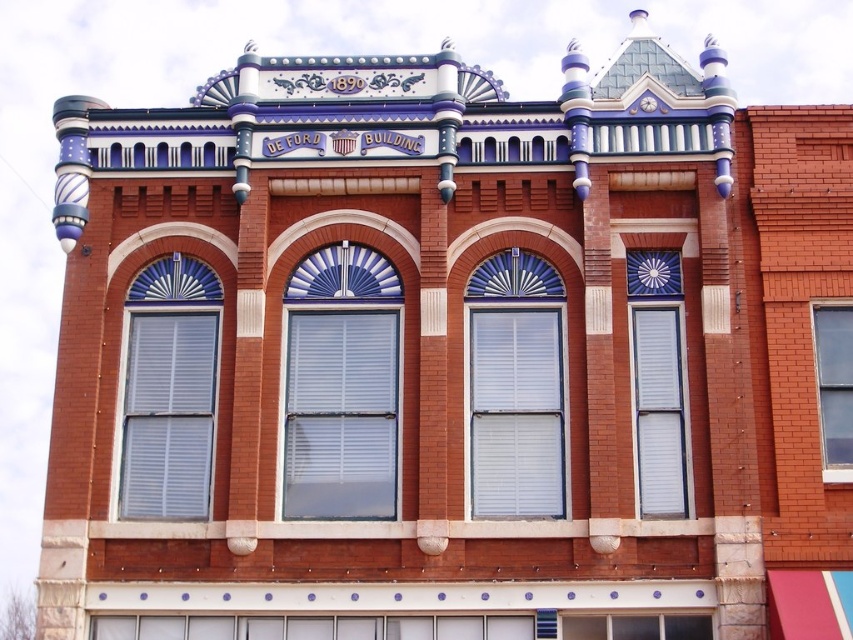
Question: Where is white painted wood window at center located in relation to white textured shutters at center in the image?

Choices:
 (A) right
 (B) left

Answer: (B)

Question: Is white matte window at left thinner than clear glass window at right?

Choices:
 (A) no
 (B) yes

Answer: (A)

Question: Does white painted wood window at center have a smaller size compared to clear glass window at right?

Choices:
 (A) yes
 (B) no

Answer: (B)

Question: Which object is the farthest from the clear glass window at right?

Choices:
 (A) white painted wood window at center
 (B) white matte window at left
 (C) white textured shutters at center

Answer: (B)

Question: Which point is closer to the camera taking this photo?

Choices:
 (A) (703, 625)
 (B) (345, 404)

Answer: (A)

Question: Among these points, which one is farthest from the camera?

Choices:
 (A) (572, 636)
 (B) (682, 426)
 (C) (515, 508)

Answer: (B)